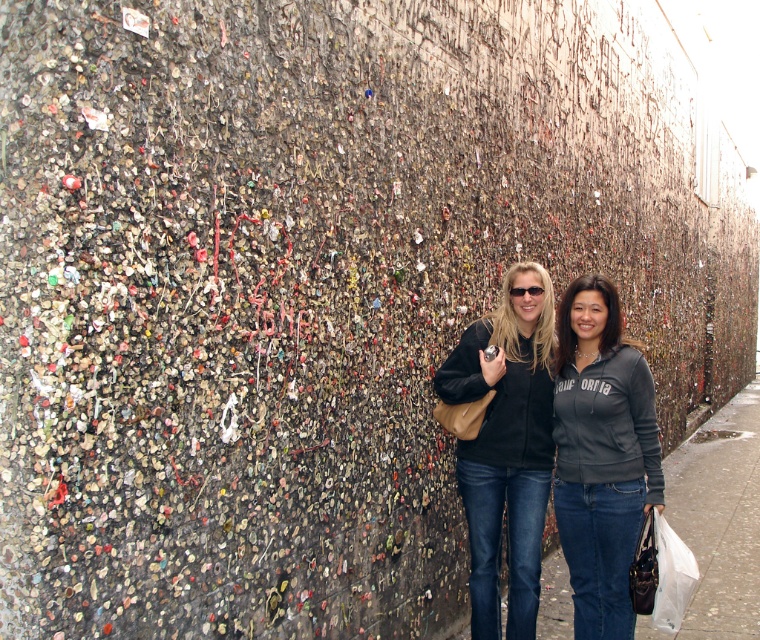
Question: Is matte black jacket at center closer to camera compared to smooth concrete sidewalk at lower right?

Choices:
 (A) no
 (B) yes

Answer: (B)

Question: Estimate the real-world distances between objects in this image. Which object is closer to the smooth concrete sidewalk at lower right?

Choices:
 (A) matte black jacket at center
 (B) dark gray zip-up jacket at center

Answer: (A)

Question: In this image, where is dark gray zip-up jacket at center located relative to matte black jacket at center?

Choices:
 (A) below
 (B) above

Answer: (B)

Question: Which point is closer to the camera?

Choices:
 (A) smooth concrete sidewalk at lower right
 (B) dark gray zip-up jacket at center

Answer: (B)

Question: Considering the real-world distances, which object is closest to the dark gray zip-up jacket at center?

Choices:
 (A) smooth concrete sidewalk at lower right
 (B) matte black jacket at center

Answer: (B)

Question: Is dark gray zip-up jacket at center to the left of matte black jacket at center from the viewer's perspective?

Choices:
 (A) no
 (B) yes

Answer: (A)